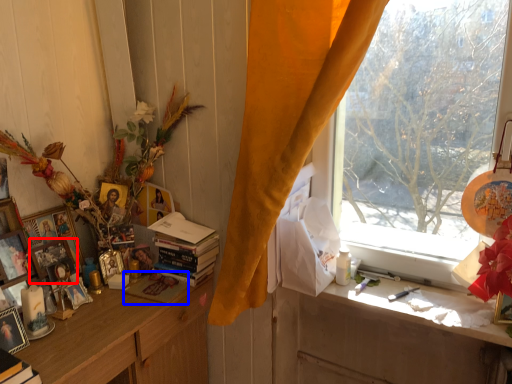
Question: Which object is further to the camera taking this photo, picture frame (highlighted by a red box) or magazine (highlighted by a blue box)?

Choices:
 (A) picture frame
 (B) magazine

Answer: (B)